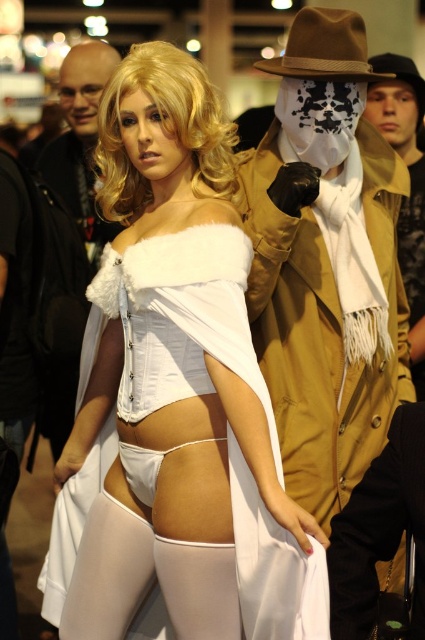
You are a photographer at a cosplay event. You want to take a photo of the white satin dress at center and the tan leather trench coat at center. The minimum distance required between subjects for your camera to focus properly is 20 inches. Will you need to adjust the subjects to ensure proper focus?

The distance between the white satin dress at center and the tan leather trench coat at center is 19.63 inches, which is less than the required 20 inches. Therefore, you will need to adjust the subjects to ensure proper focus.

You are planning to rent a costume for an upcoming event. The venue has a strict size limit of 1.5 meters in width. You see the white satin dress at center and the tan leather trench coat at center in the image. Which costume can you choose without exceeding the size limit?

The tan leather trench coat at center is smaller in size compared to the white satin dress at center, so you should choose the tan leather trench coat at center to stay within the venue size limit.